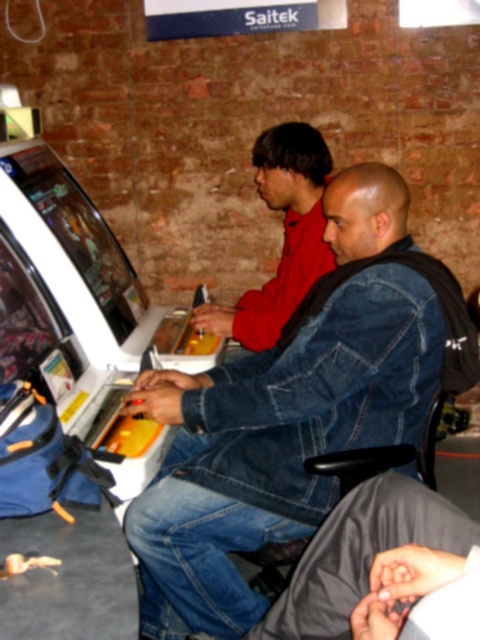
Is denim jacket at center closer to the viewer compared to red matte shirt at center?

Yes, denim jacket at center is in front of red matte shirt at center.

Does denim jacket at center come behind red matte shirt at center?

No, it is not.

Is point (376, 221) more distant than point (313, 248)?

No, it is in front of (313, 248).

Find the location of a particular element. The width and height of the screenshot is (480, 640). denim jacket at center is located at coordinates (295, 412).